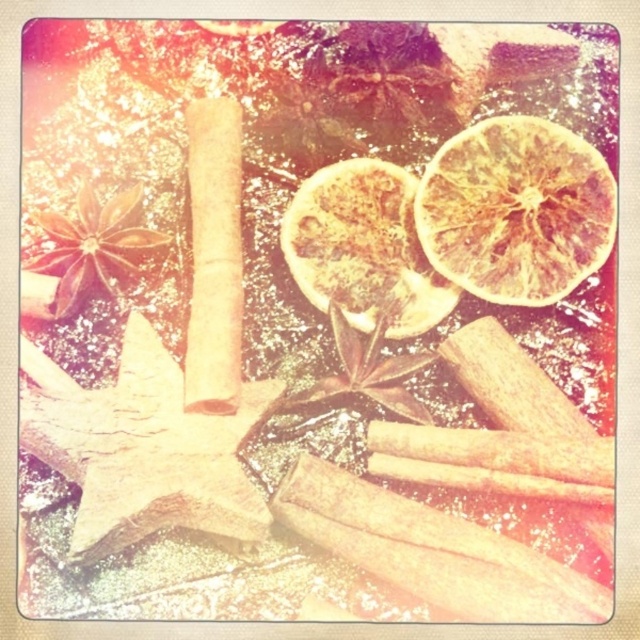
Question: Which point is farther to the camera?

Choices:
 (A) (346, 173)
 (B) (465, 172)

Answer: (A)

Question: Where is dried orange at upper right located in relation to dried orange at center in the image?

Choices:
 (A) above
 (B) below

Answer: (A)

Question: Is dried orange at upper right positioned at the back of dried orange at center?

Choices:
 (A) yes
 (B) no

Answer: (B)

Question: Which point is closer to the camera?

Choices:
 (A) pyautogui.click(x=394, y=200)
 (B) pyautogui.click(x=493, y=134)

Answer: (B)

Question: Considering the relative positions of dried orange at upper right and dried orange at center in the image provided, where is dried orange at upper right located with respect to dried orange at center?

Choices:
 (A) above
 (B) below

Answer: (A)